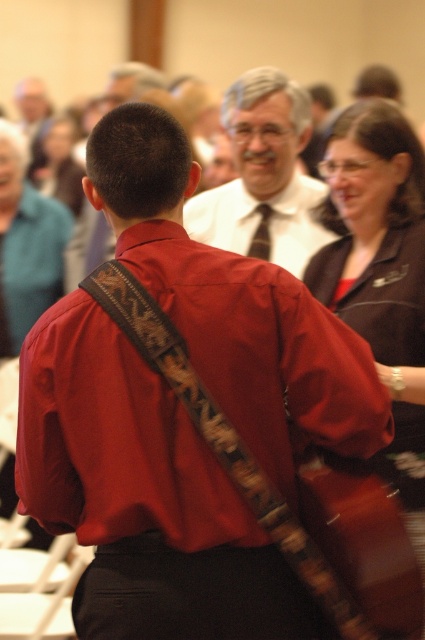
Question: Is matte white shirt at center further to the viewer compared to dark gray textured tie at center?

Choices:
 (A) no
 (B) yes

Answer: (A)

Question: Considering the real-world distances, which object is closest to the teal fabric jacket at upper left?

Choices:
 (A) matte white shirt at center
 (B) matte black shirt at upper right

Answer: (A)

Question: Which point is closer to the camera?

Choices:
 (A) (34, 204)
 (B) (374, 204)
 (C) (251, 252)
 (D) (300, 125)

Answer: (B)

Question: Is matte white shirt at center bigger than teal fabric jacket at upper left?

Choices:
 (A) yes
 (B) no

Answer: (A)

Question: Can you confirm if matte black shirt at upper right is positioned below matte white shirt at center?

Choices:
 (A) yes
 (B) no

Answer: (A)

Question: Which is farther from the teal fabric jacket at upper left?

Choices:
 (A) dark gray textured tie at center
 (B) matte white shirt at center

Answer: (A)